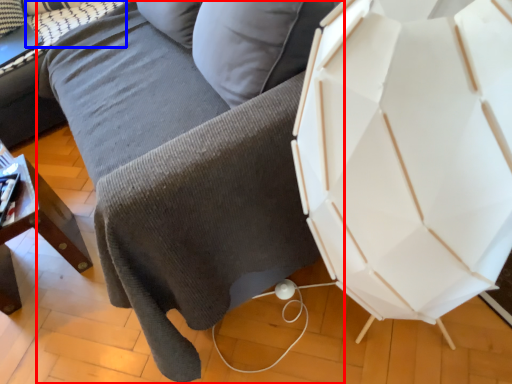
Question: Which point is closer to the camera, studio couch (highlighted by a red box) or pillow (highlighted by a blue box)?

Choices:
 (A) studio couch
 (B) pillow

Answer: (A)